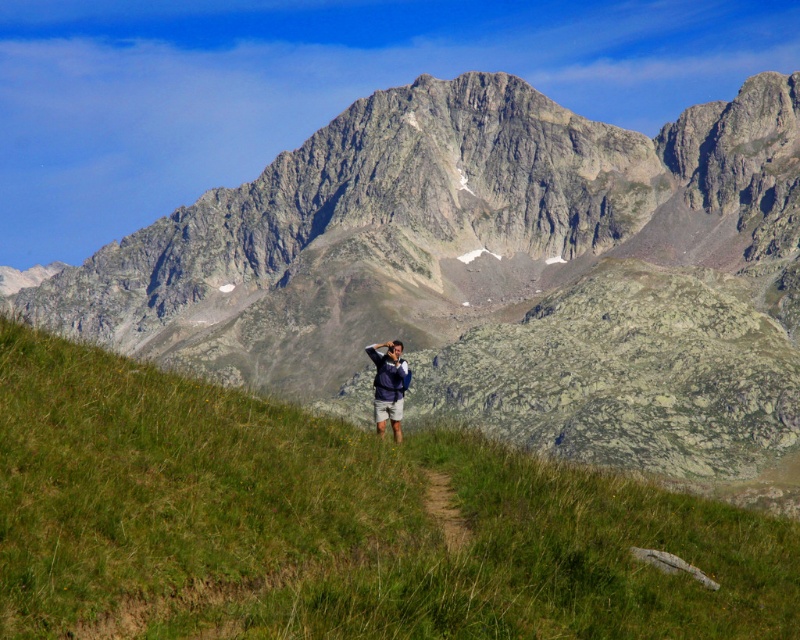
Question: Which of the following is the closest to the observer?

Choices:
 (A) (44, 616)
 (B) (382, 417)
 (C) (494, 298)

Answer: (A)

Question: Observing the image, what is the correct spatial positioning of gray rocky mountain at center in reference to matte blue jacket at center?

Choices:
 (A) above
 (B) below

Answer: (A)

Question: Which point is closer to the camera?

Choices:
 (A) (134, 412)
 (B) (420, 131)

Answer: (A)

Question: Does gray rocky mountain at center lie in front of green grassy at center?

Choices:
 (A) yes
 (B) no

Answer: (B)

Question: Which of the following is the closest to the observer?

Choices:
 (A) (372, 266)
 (B) (630, 502)
 (C) (396, 396)

Answer: (B)

Question: Can you confirm if gray rocky mountain at center is wider than matte blue jacket at center?

Choices:
 (A) no
 (B) yes

Answer: (B)